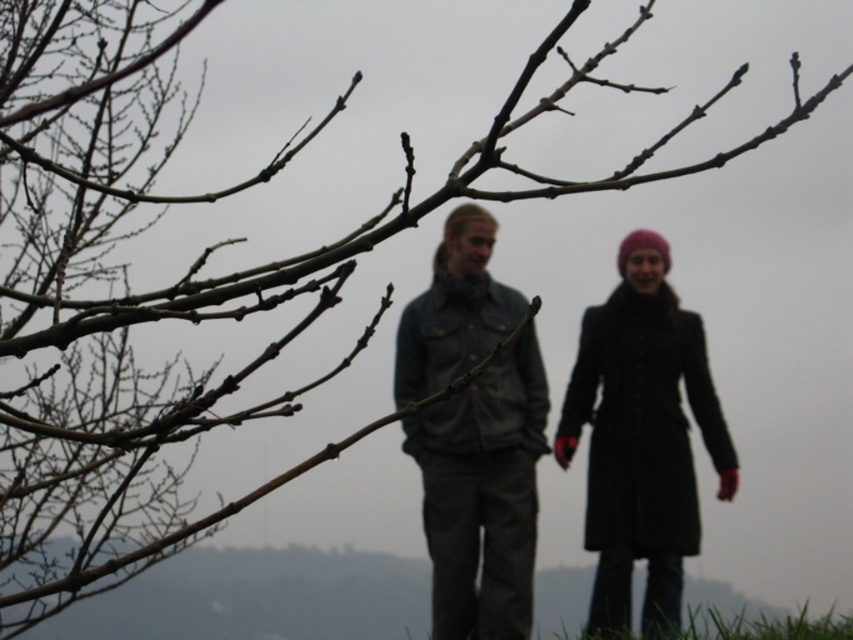
You are a photographer trying to capture a clear shot of both the denim jacket at center and the matte black coat at center. Since the tree branches are in the way, you need to adjust your position. Which subject should you focus on first to ensure it appears in front of the branches?

The denim jacket at center is closer to the viewer than the matte black coat at center, so you should focus on the denim jacket at center first to ensure it appears in front of the branches.

In the scene shown: You are trying to locate the matte black coat at center in the image. According to the coordinates provided, where would you find it?

The matte black coat at center is located at point (641, 436).

You are standing in a park and see the denim jacket at center and the green grass at lower center. Which object is closer to you?

The denim jacket at center is closer to you than the green grass at lower center.